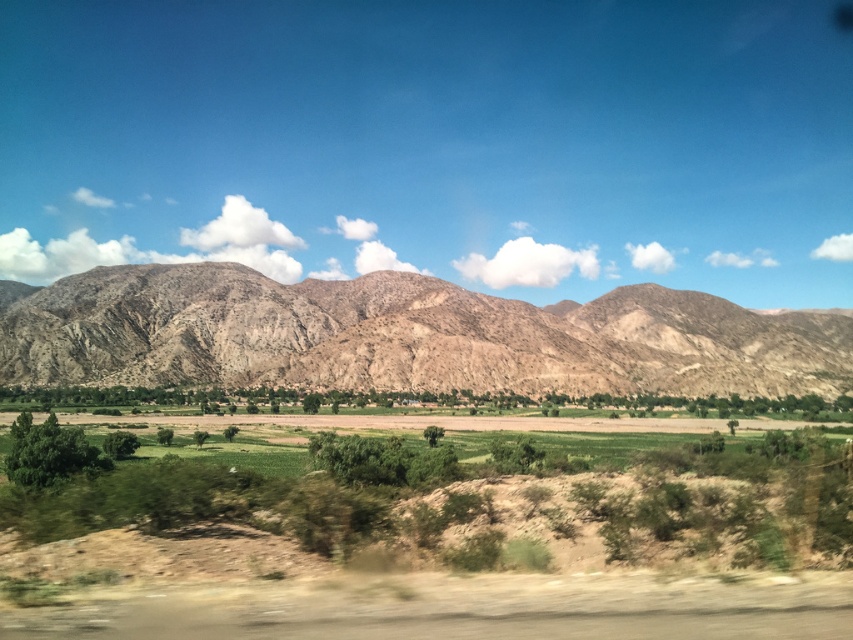
Question: Considering the relative positions of green grassy field at center and brown rocky mountain range at center in the image provided, where is green grassy field at center located with respect to brown rocky mountain range at center?

Choices:
 (A) left
 (B) right

Answer: (B)

Question: Is green grassy field at center positioned at the back of brown rocky mountain range at center?

Choices:
 (A) yes
 (B) no

Answer: (B)

Question: Among these objects, which one is farthest from the camera?

Choices:
 (A) green grassy field at center
 (B) brown rocky mountain range at center

Answer: (B)

Question: Can you confirm if green grassy field at center is positioned to the left of brown rocky mountain range at center?

Choices:
 (A) yes
 (B) no

Answer: (B)